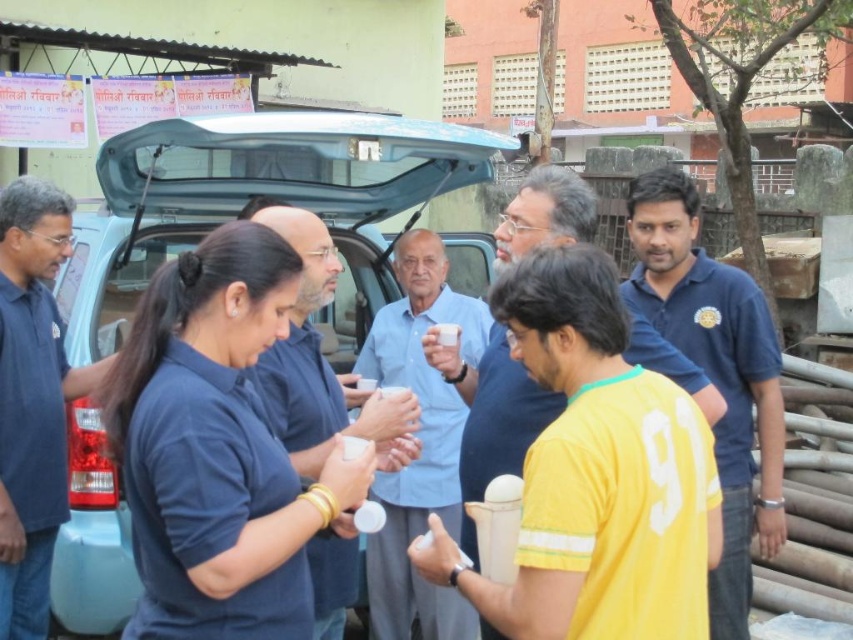
From the picture: You are standing in front of the light blue matte car at center and want to hand a document to the dark blue shirt at left. Which direction should you move to reach them?

The light blue matte car at center is located above the dark blue shirt at left, so you should move downward to reach the dark blue shirt at left.

You are standing in front of the light blue vehicle with its trunk open. You need to hand out cups to both the dark blue shirt at left and the yellow jersey at center. Which person should you approach first based on their position relative to you?

You should approach the dark blue shirt at left first because they are closer to you compared to the yellow jersey at center.

You are a photographer positioned at the back of the scene. You need to capture a photo of both the dark blue shirt at left and the yellow jersey at center. Which one should you focus on first to ensure both are in frame?

Since the dark blue shirt at left is taller than the yellow jersey at center, you should focus on the dark blue shirt at left first to ensure both are in frame.